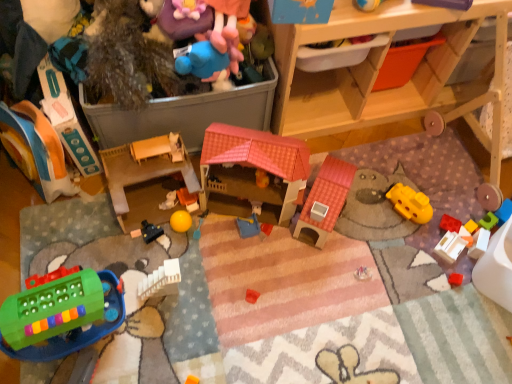
Find the location of `free space that is to the left of translucent orange cube at center, which ranks as the eleventh toy in left-to-right order`. free space that is to the left of translucent orange cube at center, which ranks as the eleventh toy in left-to-right order is located at coordinates (421, 246).